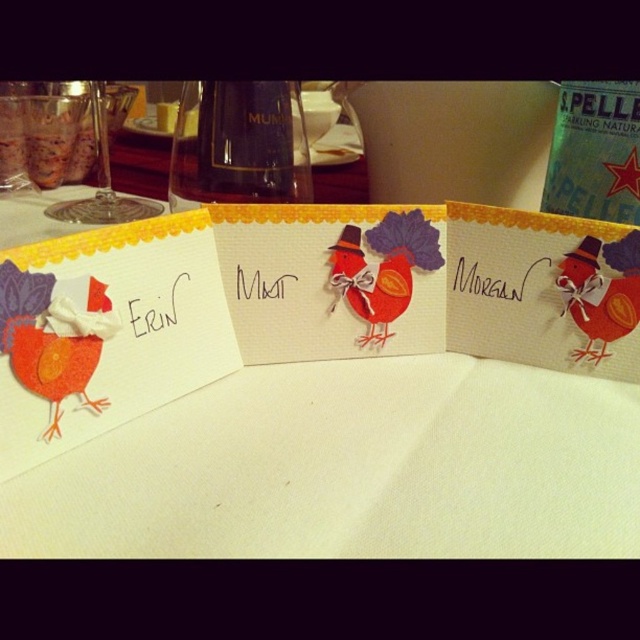
Is white paper card at center shorter than matte orange felt chicken at left?

No, white paper card at center is not shorter than matte orange felt chicken at left.

Between point (365, 436) and point (90, 404), which one is positioned behind?

The point (365, 436) is behind.

Between point (232, 248) and point (22, 323), which one is positioned in front?

Point (22, 323)

At what (x,y) coordinates should I click in order to perform the action: click on white paper card at center. Please return your answer as a coordinate pair (x, y). Image resolution: width=640 pixels, height=640 pixels. Looking at the image, I should click on pos(326,401).

Does matte paper card at left come behind matte orange felt chicken at left?

That is False.

Is matte paper card at left smaller than matte orange felt chicken at left?

Incorrect, matte paper card at left is not smaller in size than matte orange felt chicken at left.

Identify the location of matte paper card at left. (106, 332).

Locate an element on the screen. The height and width of the screenshot is (640, 640). matte paper card at left is located at coordinates (106, 332).

Between matte paper card at left and matte paper chicken at center, which one is positioned lower?

Positioned lower is matte paper card at left.

Who is more distant from viewer, (12, 449) or (355, 232)?

Positioned behind is point (355, 232).

You are a GUI agent. You are given a task and a screenshot of the screen. Output one action in this format:
    pyautogui.click(x=<x>, y=<y>)
    Task: Click on the matte paper card at left
    The height and width of the screenshot is (640, 640).
    Given the screenshot: What is the action you would take?
    pyautogui.click(x=106, y=332)